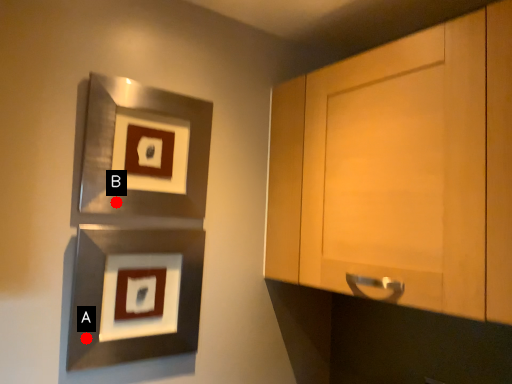
Question: Two points are circled on the image, labeled by A and B beside each circle. Which point is closer to the camera?

Choices:
 (A) A is closer
 (B) B is closer

Answer: (A)